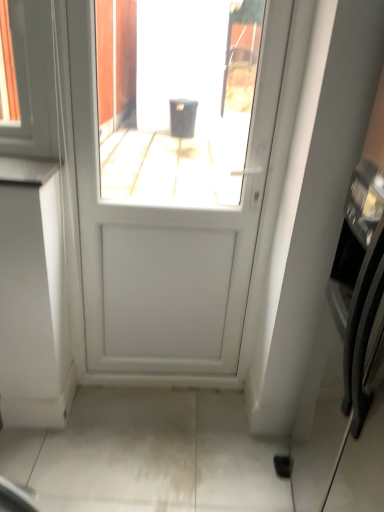
Question: Does white glossy countertop at left have a lesser height compared to satin black oven at right?

Choices:
 (A) yes
 (B) no

Answer: (A)

Question: Does white glossy countertop at left come in front of satin black oven at right?

Choices:
 (A) no
 (B) yes

Answer: (A)

Question: Does white glossy countertop at left lie behind satin black oven at right?

Choices:
 (A) yes
 (B) no

Answer: (A)

Question: From a real-world perspective, is white glossy countertop at left located beneath satin black oven at right?

Choices:
 (A) no
 (B) yes

Answer: (A)

Question: From the image's perspective, would you say white glossy countertop at left is shown under satin black oven at right?

Choices:
 (A) no
 (B) yes

Answer: (A)

Question: Is point (11, 174) closer or farther from the camera than point (331, 372)?

Choices:
 (A) farther
 (B) closer

Answer: (B)

Question: Is white glossy countertop at left taller or shorter than satin black oven at right?

Choices:
 (A) tall
 (B) short

Answer: (B)

Question: Would you say white glossy countertop at left is to the left or to the right of satin black oven at right in the picture?

Choices:
 (A) right
 (B) left

Answer: (B)

Question: From the image's perspective, is white glossy countertop at left located above or below satin black oven at right?

Choices:
 (A) above
 (B) below

Answer: (A)

Question: Relative to white glossy countertop at left, is white matte door at center in front or behind?

Choices:
 (A) behind
 (B) front

Answer: (B)

Question: Is point (117, 148) closer or farther from the camera than point (34, 173)?

Choices:
 (A) closer
 (B) farther

Answer: (B)

Question: In terms of width, does white matte door at center look wider or thinner when compared to white glossy countertop at left?

Choices:
 (A) wide
 (B) thin

Answer: (B)

Question: From a real-world perspective, is white matte door at center physically located above or below white glossy countertop at left?

Choices:
 (A) above
 (B) below

Answer: (B)

Question: From their relative heights in the image, would you say white matte door at center is taller or shorter than satin black oven at right?

Choices:
 (A) tall
 (B) short

Answer: (B)

Question: From the image's perspective, is white matte door at center located above or below satin black oven at right?

Choices:
 (A) above
 (B) below

Answer: (A)